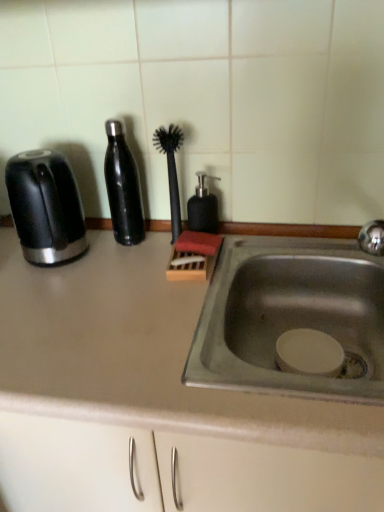
Question: From their relative heights in the image, would you say black glossy toaster at left is taller or shorter than black rubber brush at center?

Choices:
 (A) tall
 (B) short

Answer: (B)

Question: Looking at their shapes, would you say black glossy toaster at left is wider or thinner than black rubber brush at center?

Choices:
 (A) thin
 (B) wide

Answer: (B)

Question: Estimate the real-world distances between objects in this image. Which object is farther from the satin black bottle at center left?

Choices:
 (A) black matte soap dispenser at center
 (B) stainless steel sink at center
 (C) black glossy toaster at left
 (D) matte gray countertop at center
 (E) black rubber brush at center

Answer: (D)

Question: Estimate the real-world distances between objects in this image. Which object is closer to the black rubber brush at center?

Choices:
 (A) black matte soap dispenser at center
 (B) matte gray countertop at center
 (C) stainless steel sink at center
 (D) black glossy toaster at left
 (E) satin black bottle at center left

Answer: (A)